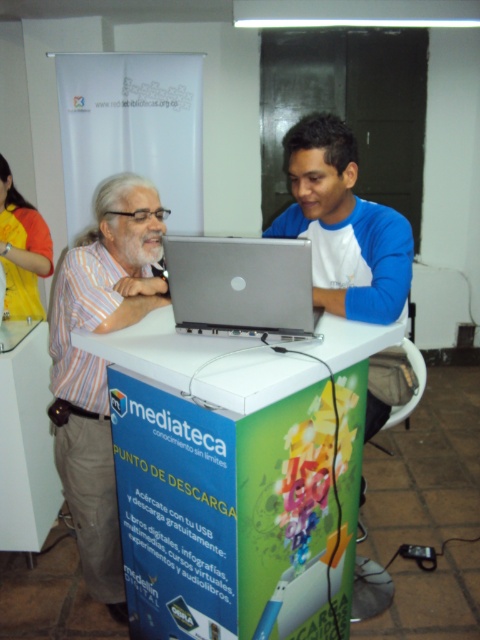
Question: Is white plastic table at center positioned before silver metallic laptop at center?

Choices:
 (A) yes
 (B) no

Answer: (A)

Question: Is silver metallic laptop at center smaller than yellow fabric shirt at left?

Choices:
 (A) no
 (B) yes

Answer: (B)

Question: Estimate the real-world distances between objects in this image. Which object is closer to the silver metallic laptop at center?

Choices:
 (A) striped cotton shirt at left
 (B) yellow fabric shirt at left

Answer: (A)

Question: Estimate the real-world distances between objects in this image. Which object is farther from the yellow fabric shirt at left?

Choices:
 (A) white plastic table at center
 (B) silver metallic laptop at center

Answer: (A)

Question: Which object is positioned closest to the silver metallic laptop at center?

Choices:
 (A) white plastic table at center
 (B) striped cotton shirt at left

Answer: (A)

Question: Is white plastic table at center behind striped cotton shirt at left?

Choices:
 (A) yes
 (B) no

Answer: (B)